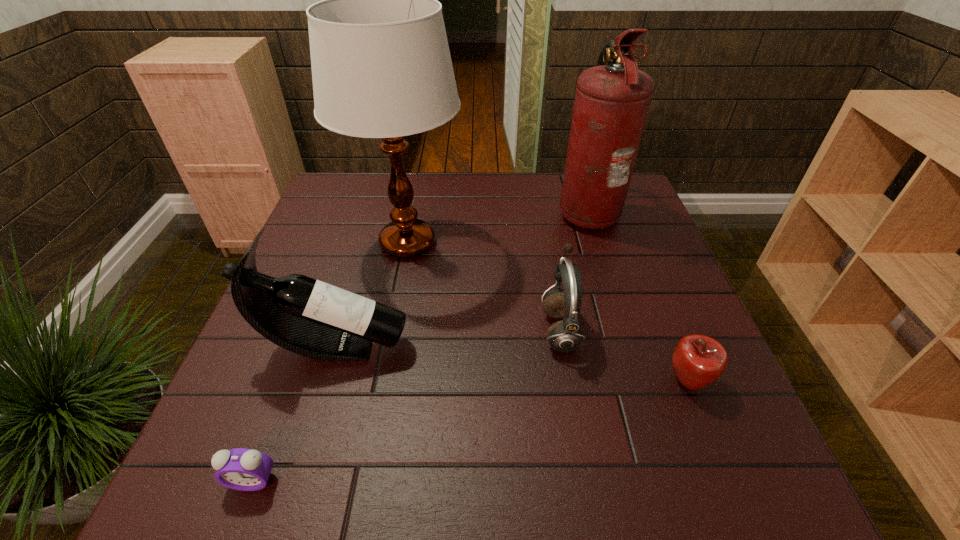
The width and height of the screenshot is (960, 540). In order to click on vacant position at the left edge of the desktop in this screenshot , I will do `click(257, 411)`.

In the image, there is a desktop. What are the coordinates of `free space at the right edge` in the screenshot? It's located at coord(723,382).

This screenshot has height=540, width=960. I want to click on vacant space at the far left corner of the desktop, so click(x=372, y=182).

Where is `vacant space that is in between the fourth shortest object and the table lamp`? This screenshot has width=960, height=540. vacant space that is in between the fourth shortest object and the table lamp is located at coordinates (372, 295).

I want to click on vacant area that lies between the alarm clock and the fire extinguisher, so click(420, 346).

Locate an element on the screen. This screenshot has height=540, width=960. empty space that is in between the wine bottle and the fire extinguisher is located at coordinates (462, 279).

Identify the location of free spot between the nearest object and the apple. (470, 431).

At what (x,y) coordinates should I click in order to perform the action: click on vacant space that's between the fire extinguisher and the table lamp. Please return your answer as a coordinate pair (x, y). The width and height of the screenshot is (960, 540). Looking at the image, I should click on (497, 227).

In order to click on empty space that is in between the table lamp and the fourth object from left to right in this screenshot , I will do `click(484, 286)`.

Where is `free space between the alarm clock and the third object from right to left`? free space between the alarm clock and the third object from right to left is located at coordinates (406, 405).